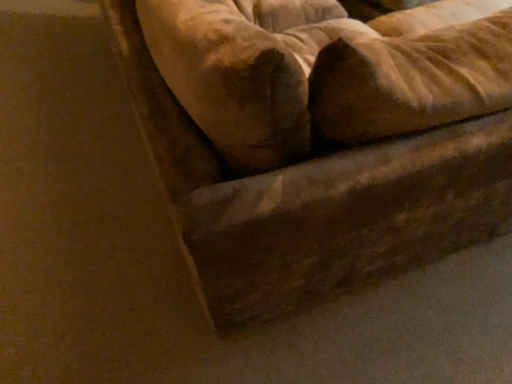
What do you see at coordinates (314, 201) in the screenshot?
I see `velvet brown couch at upper center` at bounding box center [314, 201].

At what (x,y) coordinates should I click in order to perform the action: click on velvet brown couch at upper center. Please return your answer as a coordinate pair (x, y). The width and height of the screenshot is (512, 384). Looking at the image, I should click on (314, 201).

At what (x,y) coordinates should I click in order to perform the action: click on velvet brown couch at upper center. Please return your answer as a coordinate pair (x, y). Looking at the image, I should click on (314, 201).